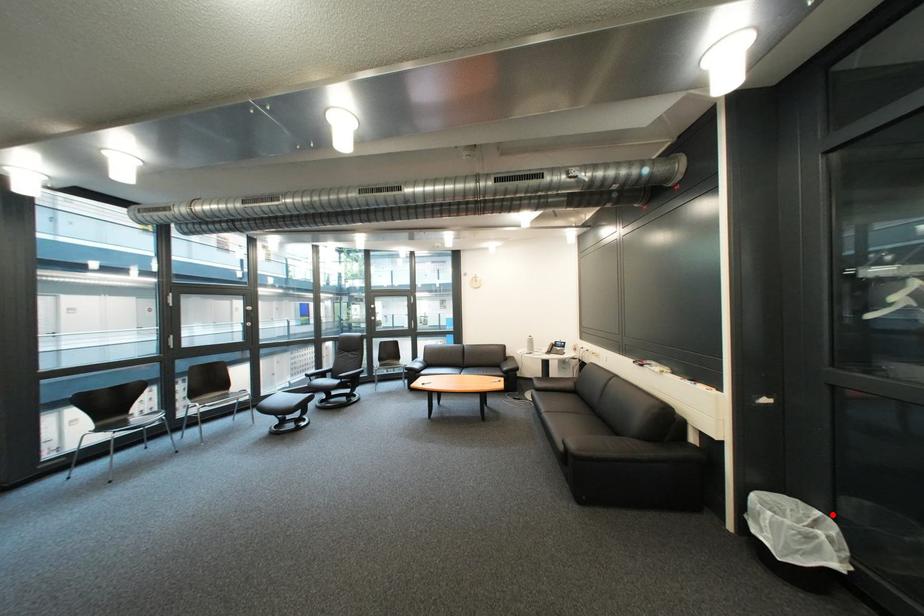
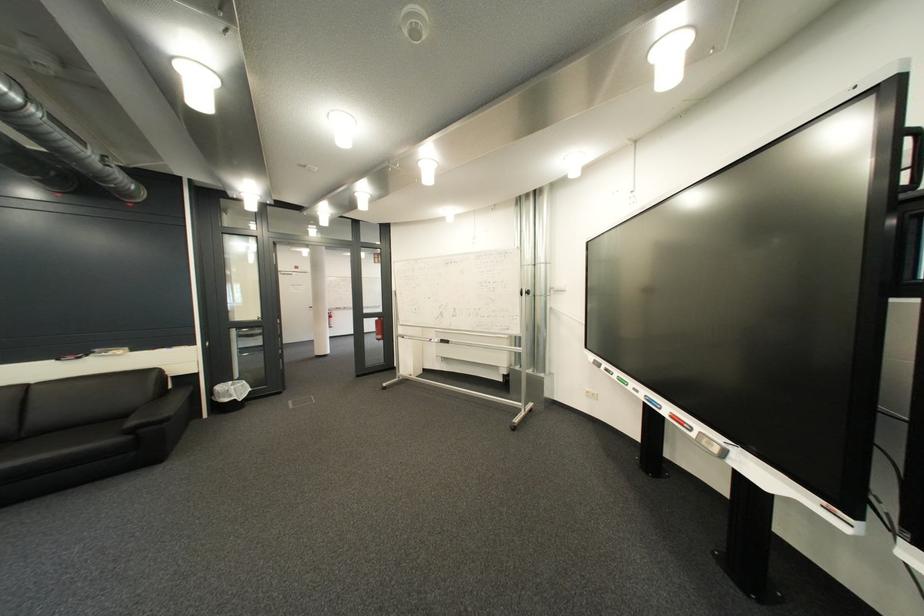
Question: I am providing you with two images of the same scene from different viewpoints. Image1 has a red point marked. In image2, the corresponding 3D location appears at what relative position? Reply with the corresponding letter.

Choices:
 (A) Closer
 (B) Farther

Answer: (A)